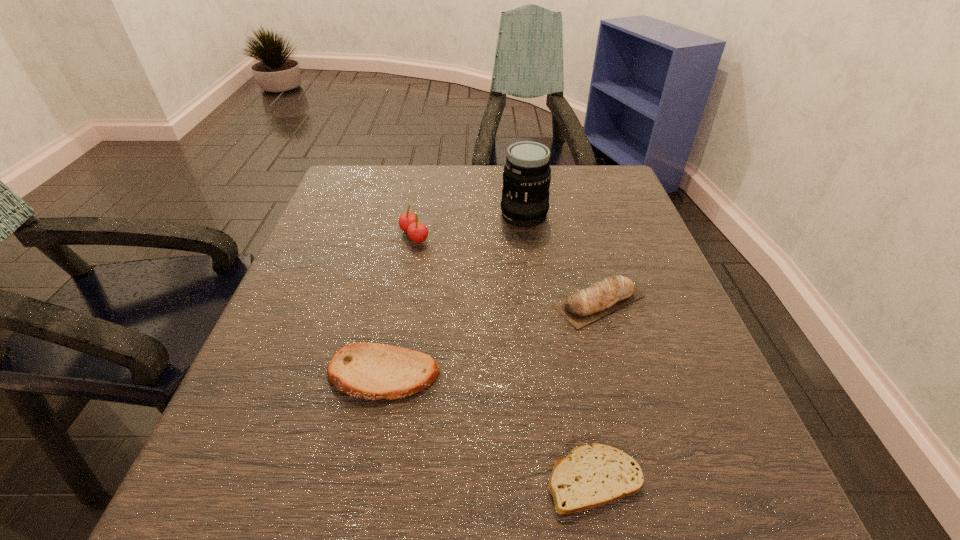
The width and height of the screenshot is (960, 540). In order to click on free point located on the front of the tallest pita bread in this screenshot , I will do `click(651, 482)`.

This screenshot has height=540, width=960. Identify the location of vacant space situated 0.300m on the back of the second nearest pita bread. (409, 241).

This screenshot has width=960, height=540. In order to click on blank space located 0.090m on the right of the shortest pita bread in this screenshot , I will do `click(710, 479)`.

Identify the location of object situated at the far edge. (526, 177).

The width and height of the screenshot is (960, 540). What are the coordinates of `object located at the near edge` in the screenshot? It's located at (594, 475).

Locate an element on the screen. Image resolution: width=960 pixels, height=540 pixels. object at the left edge is located at coordinates (371, 371).

The height and width of the screenshot is (540, 960). I want to click on object that is at the near right corner, so click(x=594, y=475).

The image size is (960, 540). I want to click on vacant space at the far edge of the desktop, so click(x=408, y=197).

In the image, there is a desktop. At what (x,y) coordinates should I click in order to perform the action: click on blank space at the near edge. Please return your answer as a coordinate pair (x, y). The image size is (960, 540). Looking at the image, I should click on (418, 492).

The height and width of the screenshot is (540, 960). I want to click on free space at the left edge, so click(x=357, y=305).